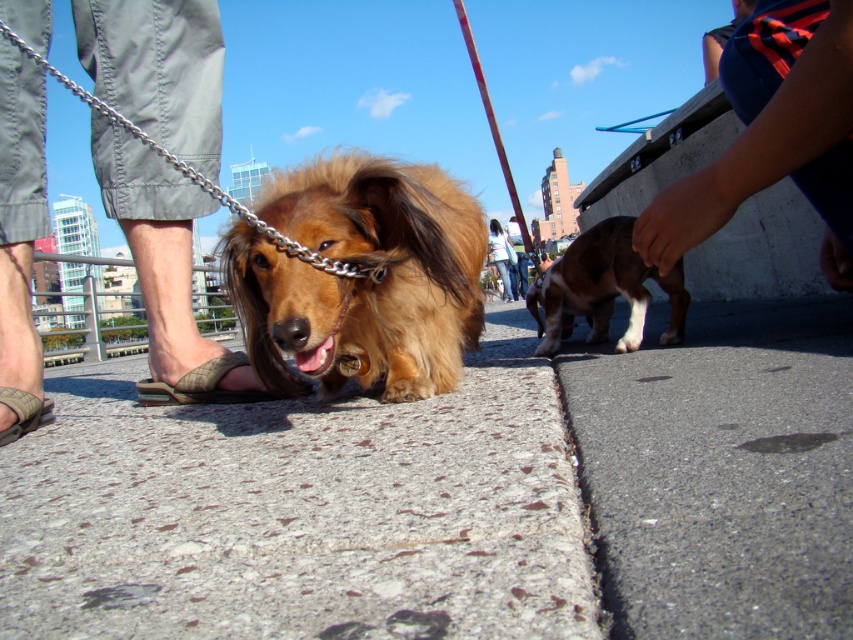
You are a small dog who wants to reach the gray fabric pants at left from the gray concrete pavement at center. Can you jump over the gap between them?

The distance between the gray concrete pavement at center and the gray fabric pants at left is 18.61 inches, so yes, a small dog can jump over the gap between them.

You are a dog trainer who wants to ensure the two dogs don not get tangled. The distance between the shiny brown fur at center and the brown and white fur at right is important. Is the current distance sufficient to prevent their leashes from tangling if they move towards each other?

The shiny brown fur at center is 26.90 inches from the brown and white fur at right. Since 26.90 inches is more than enough space for both dogs to move without their leashes tangling, the distance is sufficient.